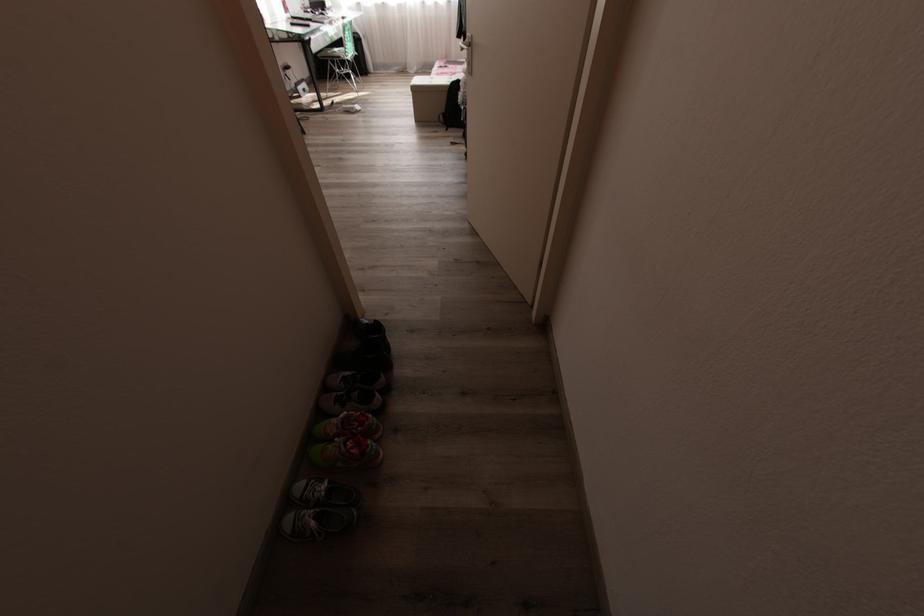
What do you see at coordinates (322, 493) in the screenshot? The width and height of the screenshot is (924, 616). I see `the grey sneaker` at bounding box center [322, 493].